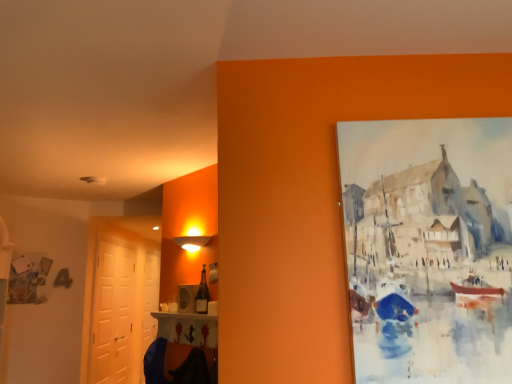
Where is `matte glass bottle at center`? matte glass bottle at center is located at coordinates (202, 294).

From a real-world perspective, is matte glass bottle at center physically below white matte door at left, acting as the second door starting from the back?

No, from a real-world perspective, matte glass bottle at center is not under white matte door at left, acting as the second door starting from the back.

Based on the photo, who is bigger, matte glass bottle at center or white matte door at left, the first door when ordered from front to back?

white matte door at left, the first door when ordered from front to back.

This screenshot has height=384, width=512. I want to click on bottle on the right side of white matte door at left, the first door when ordered from front to back, so click(x=202, y=294).

Can you tell me how much matte glass bottle at center and white matte door at left, the first door when ordered from front to back, differ in facing direction?

The angular difference between matte glass bottle at center and white matte door at left, the first door when ordered from front to back, is 138 degrees.

From a real-world perspective, is white glossy door at left, the second door when ordered from front to back, on white matte door at left, acting as the second door starting from the back?

No, from a real-world perspective, white glossy door at left, the second door when ordered from front to back, is not above white matte door at left, acting as the second door starting from the back.

Considering the relative positions of white glossy door at left, the second door when ordered from front to back, and white matte door at left, the first door when ordered from front to back, in the image provided, is white glossy door at left, the second door when ordered from front to back, to the left of white matte door at left, the first door when ordered from front to back, from the viewer's perspective?

In fact, white glossy door at left, the second door when ordered from front to back, is to the right of white matte door at left, the first door when ordered from front to back.

Choose the correct answer: Is white glossy door at left, which is counted as the 1th door, starting from the back, inside white matte door at left, the first door when ordered from front to back, or outside it?

white glossy door at left, which is counted as the 1th door, starting from the back, exists outside the volume of white matte door at left, the first door when ordered from front to back.

Where is `door that appears in front of the white glossy door at left, the second door when ordered from front to back`? Image resolution: width=512 pixels, height=384 pixels. door that appears in front of the white glossy door at left, the second door when ordered from front to back is located at coordinates click(116, 311).

Is white matte door at left, acting as the second door starting from the back, facing towards white glossy door at left, the second door when ordered from front to back?

No.

From a real-world perspective, is white matte door at left, acting as the second door starting from the back, physically below white glossy door at left, which is counted as the 1th door, starting from the back?

Actually, white matte door at left, acting as the second door starting from the back, is physically above white glossy door at left, which is counted as the 1th door, starting from the back, in the real world.

Is matte glass bottle at center positioned beyond the bounds of white glossy door at left, which is counted as the 1th door, starting from the back?

Absolutely, matte glass bottle at center is external to white glossy door at left, which is counted as the 1th door, starting from the back.

Which is more to the left, matte glass bottle at center or white glossy door at left, which is counted as the 1th door, starting from the back?

Positioned to the left is white glossy door at left, which is counted as the 1th door, starting from the back.

Is matte glass bottle at center positioned in front of white glossy door at left, which is counted as the 1th door, starting from the back?

Yes, it is.

From a real-world perspective, relative to white glossy door at left, the second door when ordered from front to back, is matte glass bottle at center vertically above or below?

Clearly, from a real-world perspective, matte glass bottle at center is above white glossy door at left, the second door when ordered from front to back.

From a real-world perspective, relative to matte glass bottle at center, is white glossy door at left, the second door when ordered from front to back, vertically above or below?

white glossy door at left, the second door when ordered from front to back, is situated lower than matte glass bottle at center in the real world.

Between point (148, 268) and point (208, 292), which one is positioned in front?

The point (208, 292) is closer.

Is white glossy door at left, which is counted as the 1th door, starting from the back, positioned beyond the bounds of matte glass bottle at center?

Yes, white glossy door at left, which is counted as the 1th door, starting from the back, is located beyond the bounds of matte glass bottle at center.

Looking at the image, does white glossy door at left, the second door when ordered from front to back, seem bigger or smaller compared to matte glass bottle at center?

white glossy door at left, the second door when ordered from front to back, is bigger than matte glass bottle at center.

How many degrees apart are the facing directions of white matte door at left, acting as the second door starting from the back, and matte glass bottle at center?

The facing directions of white matte door at left, acting as the second door starting from the back, and matte glass bottle at center are 138 degrees apart.

Between point (142, 309) and point (205, 293), which one is positioned in front?

Point (205, 293)

Is white matte door at left, the first door when ordered from front to back, positioned far away from matte glass bottle at center?

That's right, there is a large distance between white matte door at left, the first door when ordered from front to back, and matte glass bottle at center.

Does white matte door at left, acting as the second door starting from the back, appear on the right side of matte glass bottle at center?

Incorrect, white matte door at left, acting as the second door starting from the back, is not on the right side of matte glass bottle at center.

Identify the location of bottle on the right of the white matte door at left, acting as the second door starting from the back. (202, 294).

The height and width of the screenshot is (384, 512). Find the location of `door above the white glossy door at left, which is counted as the 1th door, starting from the back (from the image's perspective)`. door above the white glossy door at left, which is counted as the 1th door, starting from the back (from the image's perspective) is located at coordinates (116, 311).

Considering their positions, is matte glass bottle at center positioned closer to white matte door at left, the first door when ordered from front to back, than white glossy door at left, which is counted as the 1th door, starting from the back?

white glossy door at left, which is counted as the 1th door, starting from the back, is positioned closer to the anchor white matte door at left, the first door when ordered from front to back.

Estimate the real-world distances between objects in this image. Which object is further from white glossy door at left, which is counted as the 1th door, starting from the back, white matte door at left, acting as the second door starting from the back, or matte glass bottle at center?

matte glass bottle at center lies further to white glossy door at left, which is counted as the 1th door, starting from the back, than the other object.

Looking at the image, which one is located closer to matte glass bottle at center, white glossy door at left, which is counted as the 1th door, starting from the back, or white matte door at left, acting as the second door starting from the back?

white glossy door at left, which is counted as the 1th door, starting from the back, is positioned closer to the anchor matte glass bottle at center.

Based on their spatial positions, is white matte door at left, the first door when ordered from front to back, or white glossy door at left, which is counted as the 1th door, starting from the back, closer to matte glass bottle at center?

Among the two, white glossy door at left, which is counted as the 1th door, starting from the back, is located nearer to matte glass bottle at center.

Estimate the real-world distances between objects in this image. Which object is further from white glossy door at left, which is counted as the 1th door, starting from the back, matte glass bottle at center or white matte door at left, acting as the second door starting from the back?

matte glass bottle at center lies further to white glossy door at left, which is counted as the 1th door, starting from the back, than the other object.

Estimate the real-world distances between objects in this image. Which object is further from white matte door at left, acting as the second door starting from the back, white glossy door at left, which is counted as the 1th door, starting from the back, or matte glass bottle at center?

matte glass bottle at center lies further to white matte door at left, acting as the second door starting from the back, than the other object.

The image size is (512, 384). Identify the location of door between matte glass bottle at center and white glossy door at left, the second door when ordered from front to back, from front to back. (116, 311).